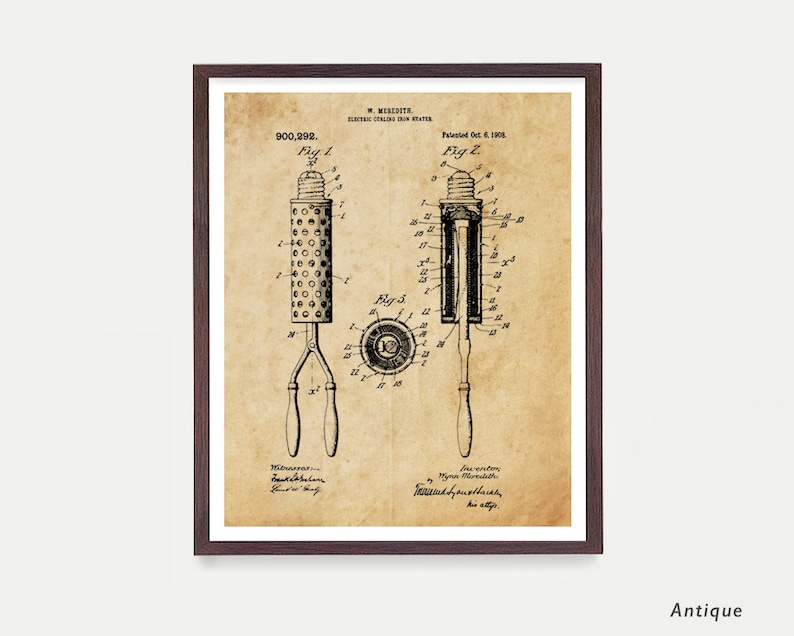
Find the location of a particular element. handle is located at coordinates (467, 357), (463, 397), (329, 404), (328, 432), (288, 422).